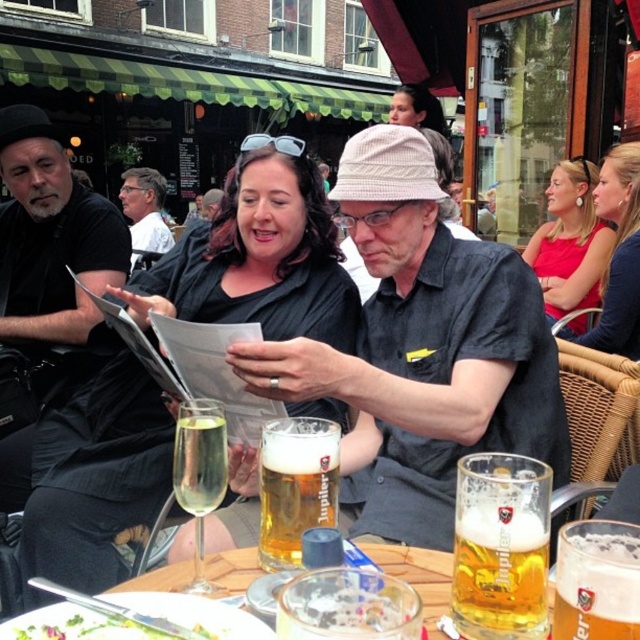
You are a photographer standing in front of the round wooden table. You want to take a photo of the black matte shirt at center and the golden glass beer at center. Which object will appear larger in your photo?

The black matte shirt at center will appear larger in the photo because it is closer to the viewer than the golden glass beer at center.